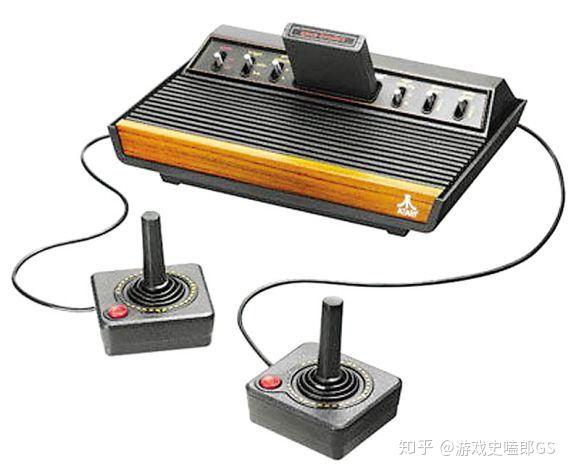
I want to click on atari console, so click(x=260, y=40).